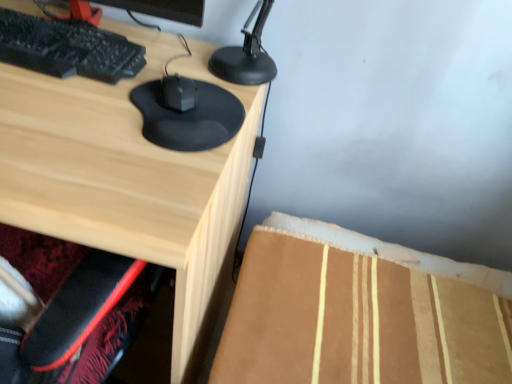
Where is `free spot behind black matte mouse at center`? The image size is (512, 384). free spot behind black matte mouse at center is located at coordinates (199, 73).